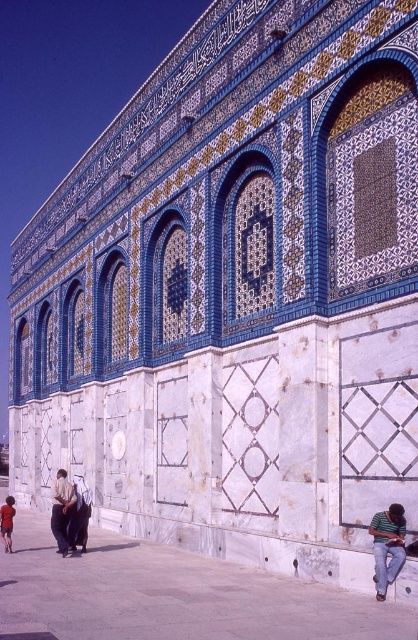
Question: Based on their relative distances, which object is nearer to the green t-shirt at lower right?

Choices:
 (A) dark brown leather jacket at lower left
 (B) red fabric child at lower left

Answer: (A)

Question: Does green t-shirt at lower right lie in front of red fabric child at lower left?

Choices:
 (A) yes
 (B) no

Answer: (A)

Question: Which object is the closest to the dark brown leather jacket at lower left?

Choices:
 (A) red fabric child at lower left
 (B) green t-shirt at lower right

Answer: (A)

Question: Does dark brown leather jacket at lower left appear on the right side of red fabric child at lower left?

Choices:
 (A) yes
 (B) no

Answer: (A)

Question: Can you confirm if green t-shirt at lower right is bigger than dark brown leather jacket at lower left?

Choices:
 (A) no
 (B) yes

Answer: (A)

Question: Among these points, which one is farthest from the camera?

Choices:
 (A) (397, 556)
 (B) (60, 476)
 (C) (7, 545)

Answer: (B)